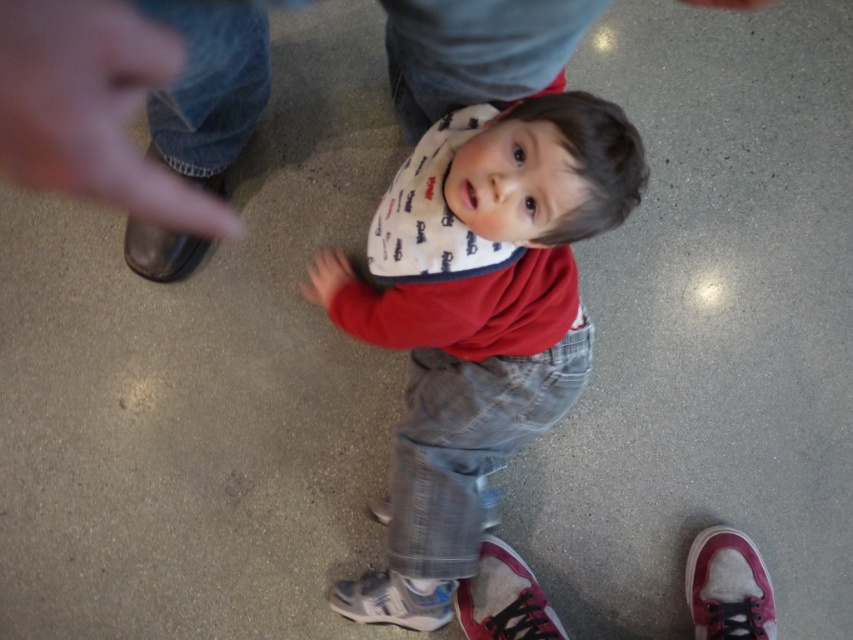
You are standing at the center of the room and want to move to the white textured sneaker at lower center. What direction should you move in to reach it?

Since the white textured sneaker at lower center is located at point 0.939 on the x axis and 0.461 on the y axis, you should move towards the lower right direction to reach it.

In the scene shown: You are standing in the room and want to place a new rug. The rug will be placed at the point marked as point (392, 600). What object is currently located at that point?

The white textured sneaker at lower center is located at point (392, 600).